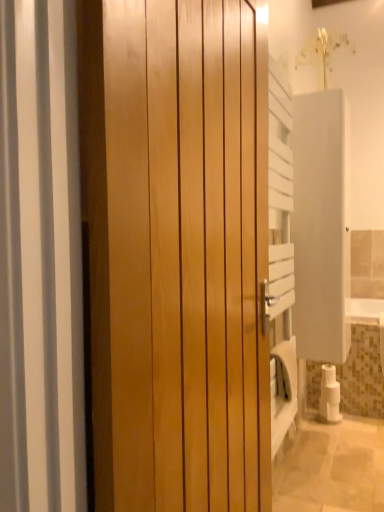
What do you see at coordinates (329, 395) in the screenshot?
I see `white matte toilet paper at lower right` at bounding box center [329, 395].

Find the location of `white matte toilet paper at lower right`. white matte toilet paper at lower right is located at coordinates (329, 395).

This screenshot has height=512, width=384. Describe the element at coordinates (176, 252) in the screenshot. I see `glossy wood door at center` at that location.

What are the coordinates of `white matte toilet paper at lower right` in the screenshot? It's located at coord(329,395).

Is white matte toilet paper at lower right smaller than white matte screen door at right?

Indeed, white matte toilet paper at lower right has a smaller size compared to white matte screen door at right.

Is white matte toilet paper at lower right at the left side of white matte screen door at right?

No.

Locate an element on the screen. The width and height of the screenshot is (384, 512). toilet paper that appears behind the white matte screen door at right is located at coordinates (329, 395).

Who is taller, white matte toilet paper at lower right or white matte screen door at right?

With more height is white matte screen door at right.

Measure the distance between glossy wood door at center and white matte screen door at right.

3.76 feet.

Could you tell me if glossy wood door at center is turned towards white matte screen door at right?

No.

Which of these two, glossy wood door at center or white matte screen door at right, stands taller?

Standing taller between the two is glossy wood door at center.

Who is more distant, glossy wood door at center or white matte toilet paper at lower right?

Positioned behind is white matte toilet paper at lower right.

The height and width of the screenshot is (512, 384). What are the coordinates of `toilet paper below the glossy wood door at center (from a real-world perspective)` in the screenshot? It's located at (329, 395).

Based on the photo, does glossy wood door at center touch white matte toilet paper at lower right?

They are not placed beside each other.

From the image's perspective, which object appears higher, white matte screen door at right or white matte toilet paper at lower right?

white matte screen door at right.

Image resolution: width=384 pixels, height=512 pixels. In the image, there is a white matte toilet paper at lower right. In order to click on screen door above it (from the image's perspective) in this screenshot , I will do `click(321, 225)`.

Could you tell me if white matte screen door at right is turned towards white matte toilet paper at lower right?

No, white matte screen door at right is not facing towards white matte toilet paper at lower right.

Is white matte toilet paper at lower right wider than glossy wood door at center?

No.

How much distance is there between white matte toilet paper at lower right and glossy wood door at center?

white matte toilet paper at lower right is 6.10 feet from glossy wood door at center.

Is point (330, 382) more distant than point (176, 139)?

Yes, point (330, 382) is behind point (176, 139).

Is white matte toilet paper at lower right aimed at glossy wood door at center?

No, white matte toilet paper at lower right is not aimed at glossy wood door at center.

Is white matte screen door at right next to glossy wood door at center?

No.

Can you confirm if white matte screen door at right is taller than glossy wood door at center?

In fact, white matte screen door at right may be shorter than glossy wood door at center.

Which is further, (304, 162) or (130, 457)?

The point (304, 162) is behind.

Where is `toilet paper behind the white matte screen door at right`? toilet paper behind the white matte screen door at right is located at coordinates (329, 395).

Where is `door in front of the white matte screen door at right`? This screenshot has height=512, width=384. door in front of the white matte screen door at right is located at coordinates (176, 252).

Looking at the image, which one is located closer to white matte toilet paper at lower right, white matte screen door at right or glossy wood door at center?

white matte screen door at right lies closer to white matte toilet paper at lower right than the other object.

From the image, which object appears to be nearer to white matte toilet paper at lower right, glossy wood door at center or white matte screen door at right?

Among the two, white matte screen door at right is located nearer to white matte toilet paper at lower right.

Based on their spatial positions, is white matte toilet paper at lower right or glossy wood door at center further from white matte screen door at right?

glossy wood door at center is positioned further to the anchor white matte screen door at right.

Estimate the real-world distances between objects in this image. Which object is further from glossy wood door at center, white matte toilet paper at lower right or white matte screen door at right?

white matte toilet paper at lower right lies further to glossy wood door at center than the other object.

From the image, which object appears to be farther from glossy wood door at center, white matte screen door at right or white matte toilet paper at lower right?

Based on the image, white matte toilet paper at lower right appears to be further to glossy wood door at center.

Considering their positions, is glossy wood door at center positioned closer to white matte screen door at right than white matte toilet paper at lower right?

Based on the image, white matte toilet paper at lower right appears to be nearer to white matte screen door at right.

Where is `screen door between glossy wood door at center and white matte toilet paper at lower right along the z-axis`? screen door between glossy wood door at center and white matte toilet paper at lower right along the z-axis is located at coordinates (321, 225).